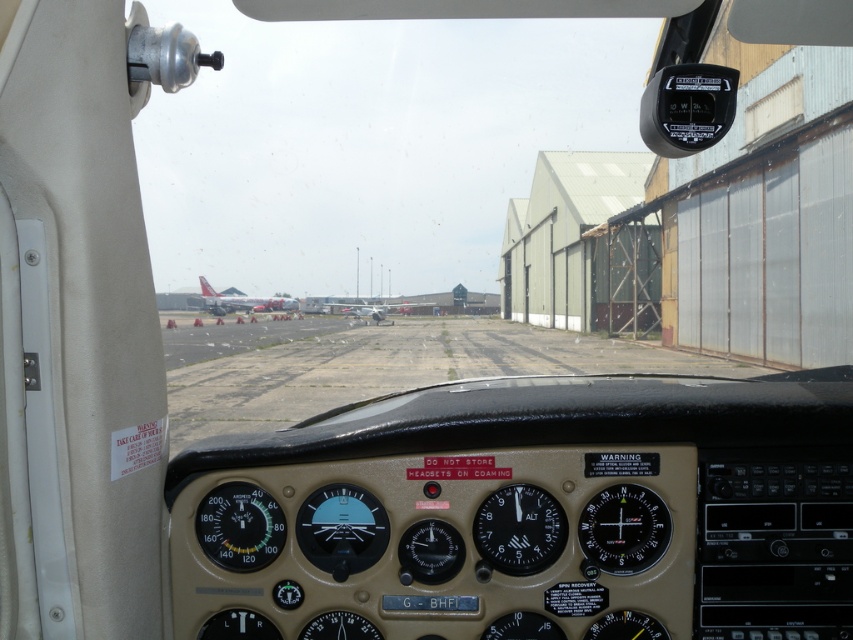
Question: Among these objects, which one is nearest to the camera?

Choices:
 (A) black plastic gauge at center
 (B) metallic gray airplane at center
 (C) silver metallic airplane at center
 (D) black plastic compass at center

Answer: (D)

Question: Is transparent glass altimeter at center above metallic gray airplane at center?

Choices:
 (A) no
 (B) yes

Answer: (A)

Question: Is black plastic gauge at center further to camera compared to metallic gray airplane at center?

Choices:
 (A) no
 (B) yes

Answer: (A)

Question: Does black plastic gauge at center appear on the right side of silver metallic airplane at center?

Choices:
 (A) yes
 (B) no

Answer: (A)

Question: Which point is farther from the camera taking this photo?

Choices:
 (A) (347, 484)
 (B) (374, 301)
 (C) (554, 509)

Answer: (B)

Question: Based on their relative distances, which object is farther from the transparent glass altimeter at center?

Choices:
 (A) black plastic altimeter at center
 (B) metallic gray airplane at center
 (C) black plastic compass at center
 (D) black plastic gauge at center

Answer: (B)